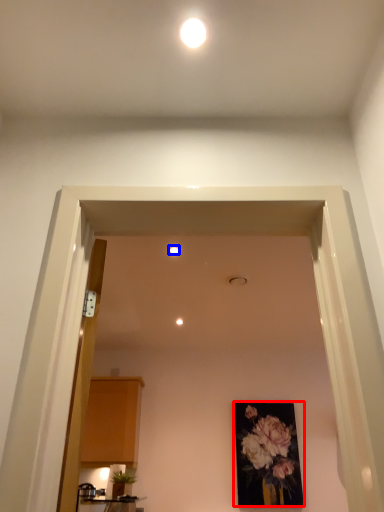
Question: Which object appears farthest to the camera in this image, picture frame (highlighted by a red box) or lighting (highlighted by a blue box)?

Choices:
 (A) picture frame
 (B) lighting

Answer: (A)